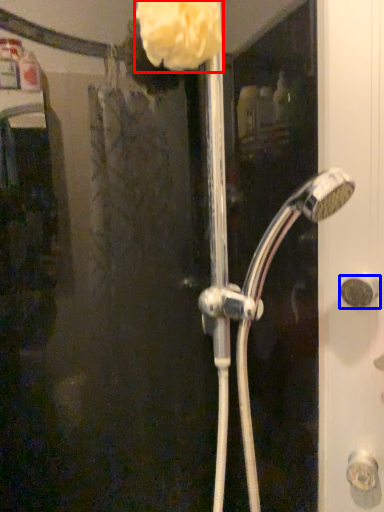
Question: Which point is closer to the camera, flower (highlighted by a red box) or door handle (highlighted by a blue box)?

Choices:
 (A) flower
 (B) door handle

Answer: (A)